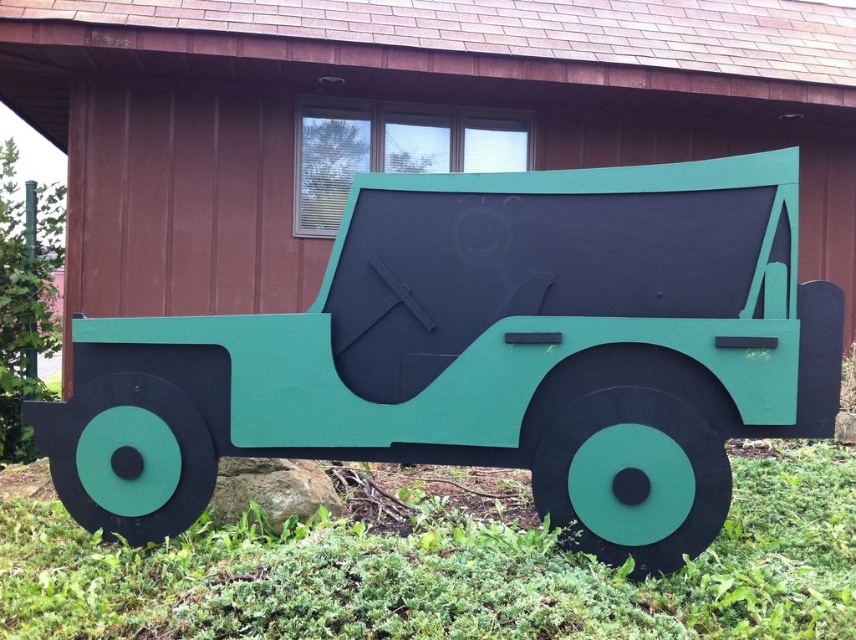
Which is below, matte green jeep at center or green matte grass at lower center?

green matte grass at lower center is below.

Between point (752, 406) and point (256, 595), which one is positioned behind?

The point (752, 406) is more distant.

Where is `matte green jeep at center`? matte green jeep at center is located at coordinates (486, 355).

Is green matte jeep at center taller than green matte grass at lower center?

Yes, green matte jeep at center is taller than green matte grass at lower center.

This screenshot has width=856, height=640. Identify the location of green matte jeep at center. (395, 118).

Between point (411, 26) and point (770, 460), which one is positioned behind?

The point (411, 26) is behind.

Image resolution: width=856 pixels, height=640 pixels. In order to click on green matte jeep at center in this screenshot , I will do `click(395, 118)`.

Between matte green jeep at center and green matte jeep at center, which one appears on the right side from the viewer's perspective?

matte green jeep at center is more to the right.

Between matte green jeep at center and green matte jeep at center, which one has more height?

Standing taller between the two is green matte jeep at center.

Between point (726, 408) and point (218, 192), which one is positioned behind?

The point (218, 192) is behind.

Identify the location of matte green jeep at center. (486, 355).